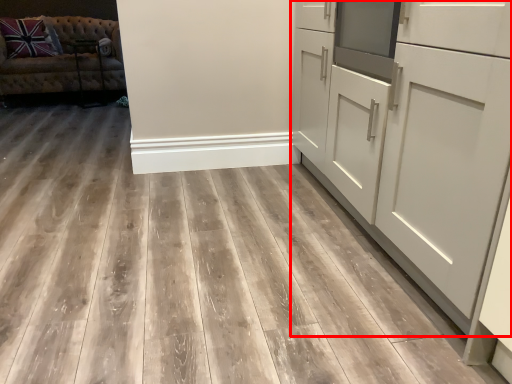
Question: Considering the relative positions of cabinetry (annotated by the red box) and studio couch in the image provided, where is cabinetry (annotated by the red box) located with respect to the staircase?

Choices:
 (A) left
 (B) right

Answer: (B)